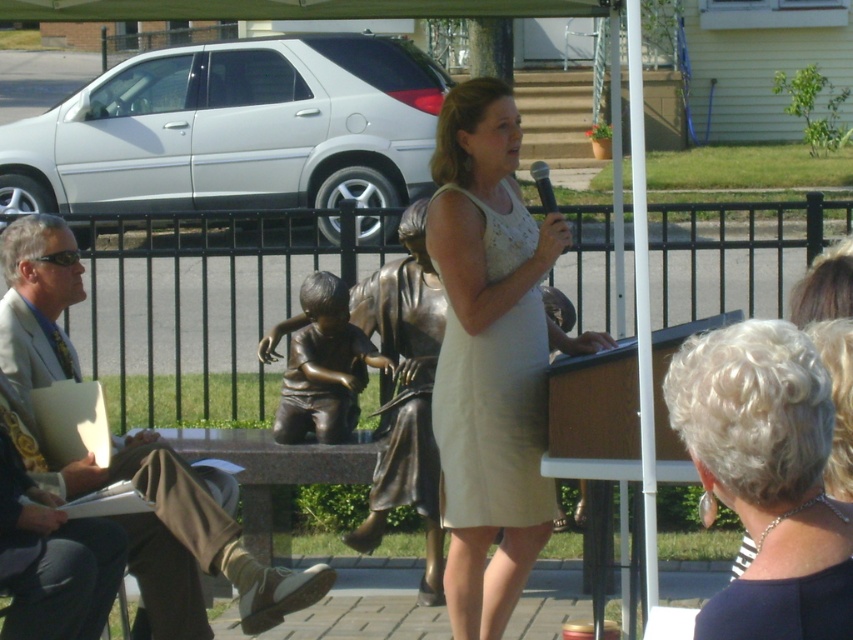
You are an event photographer at the outdoor event. You need to capture a photo where both the white textured hair at upper right and the light brown suit at left are clearly visible. Which object should you adjust your camera focus on first to ensure proper framing?

The white textured hair at upper right has a lesser width compared to the light brown suit at left, so you should focus on the light brown suit at left first since it is wider and will take up more of the frame.

You are standing at the podium and want to walk to the sculpture. Which of the two points, point (142, 438) or point (312, 417), is closer to you?

Point (142, 438) is closer to the viewer than point (312, 417), so you should head towards point (142, 438).